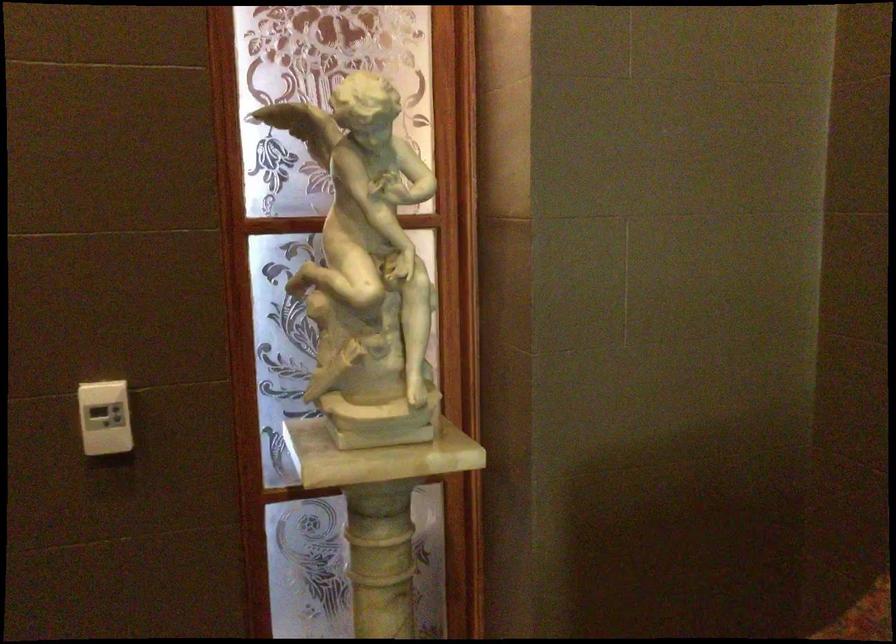
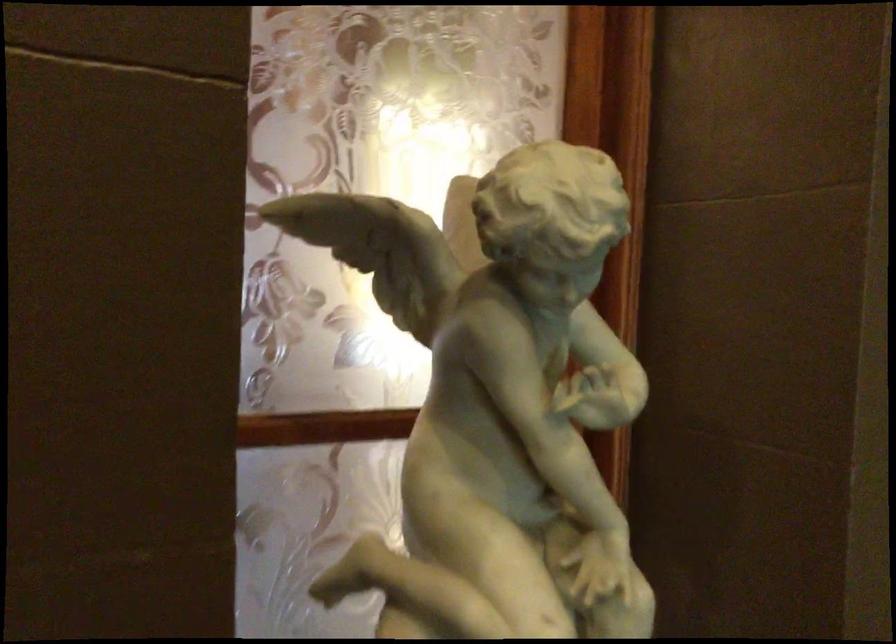
Question: The camera is either moving clockwise (left) or counter-clockwise (right) around the object. The first image is from the beginning of the video and the second image is from the end. Is the camera moving left or right when shooting the video?

Choices:
 (A) Left
 (B) Right

Answer: (A)